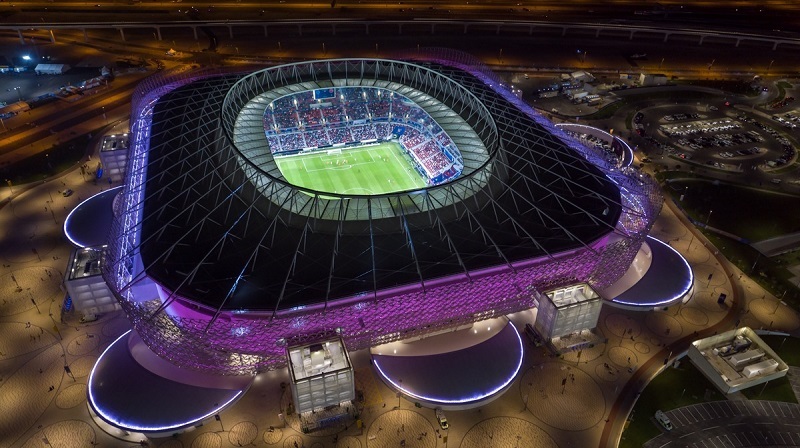
Locate an element on the screen. cover is located at coordinates (94, 219).